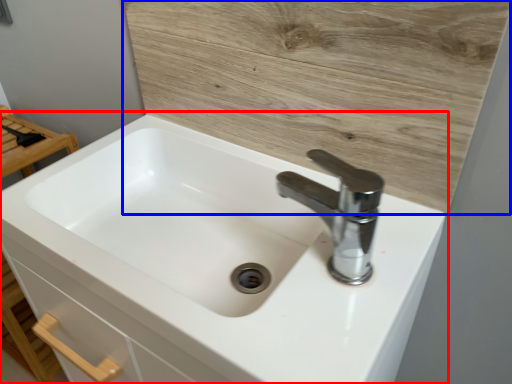
Question: Which object is further to the camera taking this photo, sink (highlighted by a red box) or plywood (highlighted by a blue box)?

Choices:
 (A) sink
 (B) plywood

Answer: (B)